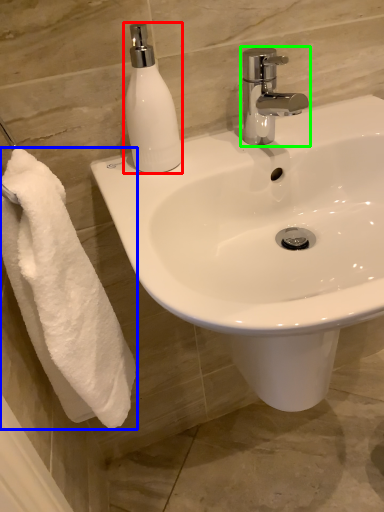
Question: Estimate the real-world distances between objects in this image. Which object is farther from soap dispenser (highlighted by a red box), towel (highlighted by a blue box) or tap (highlighted by a green box)?

Choices:
 (A) towel
 (B) tap

Answer: (A)